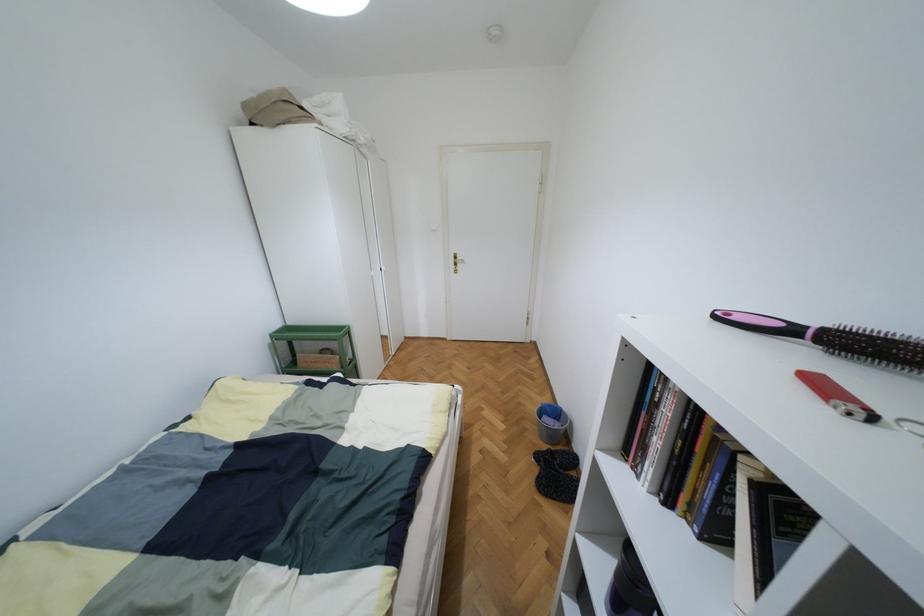
Find where to pull the gold door handle. Please return your answer as a coordinate pair (x, y).

(456, 261)